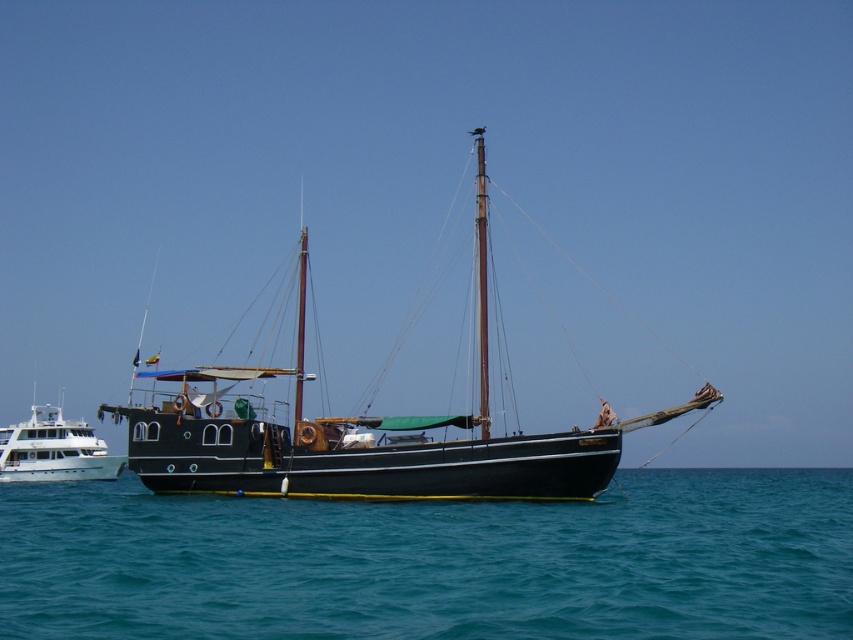
You are standing on the deck of the white glossy yacht at left and want to see the blue water at lower center. In which direction should you look relative to the yacht?

The blue water at lower center is in front of the white glossy yacht at left, so you should look forward from the yacht to see the blue water at lower center.